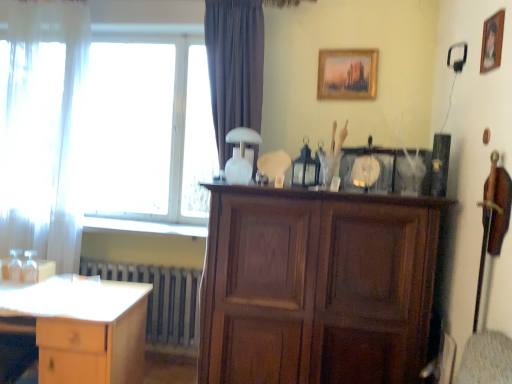
Question: Is white sheer curtain at left facing away from transparent glass window at upper left?

Choices:
 (A) no
 (B) yes

Answer: (A)

Question: From the image's perspective, does white sheer curtain at left appear lower than transparent glass window at upper left?

Choices:
 (A) yes
 (B) no

Answer: (A)

Question: Is white sheer curtain at left at the right side of transparent glass window at upper left?

Choices:
 (A) yes
 (B) no

Answer: (B)

Question: Is the depth of white sheer curtain at left less than that of transparent glass window at upper left?

Choices:
 (A) yes
 (B) no

Answer: (A)

Question: Can you confirm if white sheer curtain at left is wider than transparent glass window at upper left?

Choices:
 (A) no
 (B) yes

Answer: (B)

Question: Considering the positions of light wood desk at lower left and wooden cabinet at center in the image, is light wood desk at lower left wider or thinner than wooden cabinet at center?

Choices:
 (A) thin
 (B) wide

Answer: (B)

Question: In terms of size, does light wood desk at lower left appear bigger or smaller than wooden cabinet at center?

Choices:
 (A) small
 (B) big

Answer: (A)

Question: Is light wood desk at lower left taller or shorter than wooden cabinet at center?

Choices:
 (A) tall
 (B) short

Answer: (B)

Question: From the image's perspective, is light wood desk at lower left located above or below wooden cabinet at center?

Choices:
 (A) above
 (B) below

Answer: (B)

Question: From the image's perspective, is wooden picture frame at upper right, the first picture frame from the right, positioned above or below wooden cabinet at center?

Choices:
 (A) above
 (B) below

Answer: (A)

Question: Is wooden picture frame at upper right, the first picture frame from the right, bigger or smaller than wooden cabinet at center?

Choices:
 (A) big
 (B) small

Answer: (B)

Question: Does point (500, 11) appear closer or farther from the camera than point (328, 264)?

Choices:
 (A) farther
 (B) closer

Answer: (B)

Question: From a real-world perspective, is wooden picture frame at upper right, placed as the 2th picture frame when sorted from back to front, physically located above or below wooden cabinet at center?

Choices:
 (A) above
 (B) below

Answer: (A)

Question: Looking at the image, does metallic gray radiator at lower left seem bigger or smaller compared to gold-framed painting at upper center, which ranks as the 1th picture frame in left-to-right order?

Choices:
 (A) small
 (B) big

Answer: (B)

Question: From the image's perspective, relative to gold-framed painting at upper center, which ranks as the 1th picture frame in left-to-right order, is metallic gray radiator at lower left above or below?

Choices:
 (A) below
 (B) above

Answer: (A)